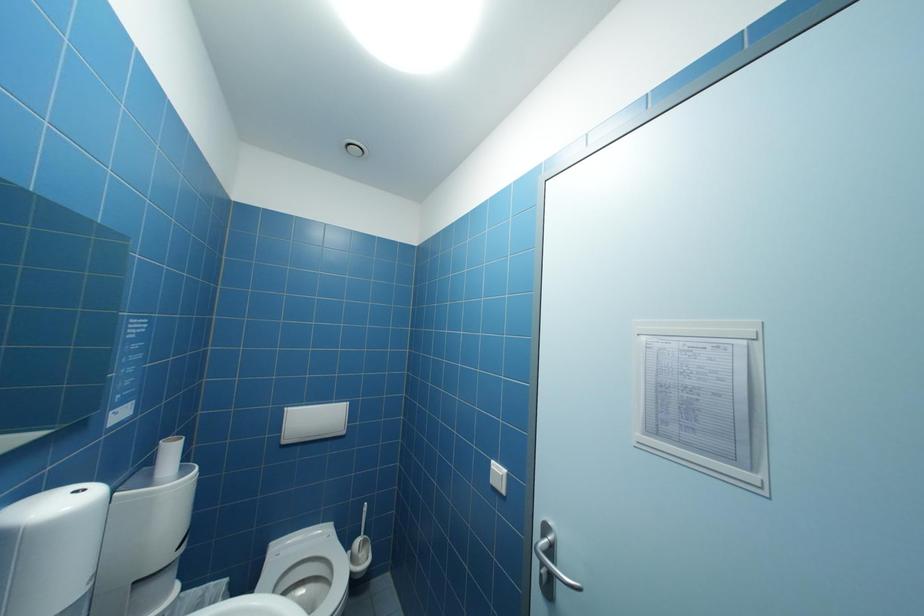
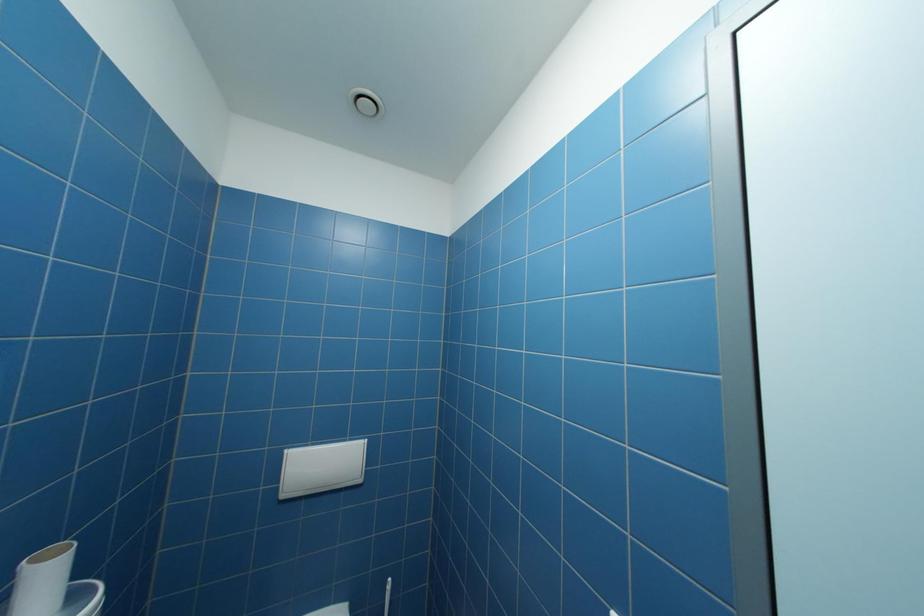
Question: The images are taken continuously from a first-person perspective. In which direction is your viewpoint rotating?

Choices:
 (A) Left
 (B) Right
 (C) Up
 (D) Down

Answer: (A)